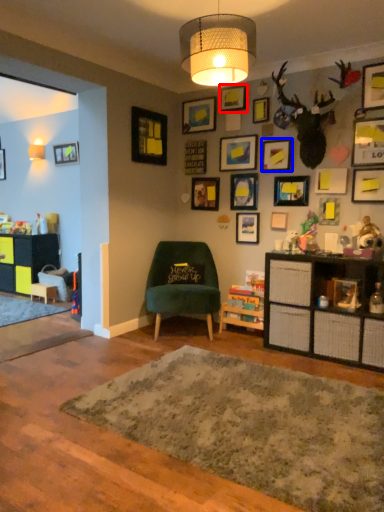
Question: Among these objects, which one is farthest to the camera, picture frame (highlighted by a red box) or picture frame (highlighted by a blue box)?

Choices:
 (A) picture frame
 (B) picture frame

Answer: (A)